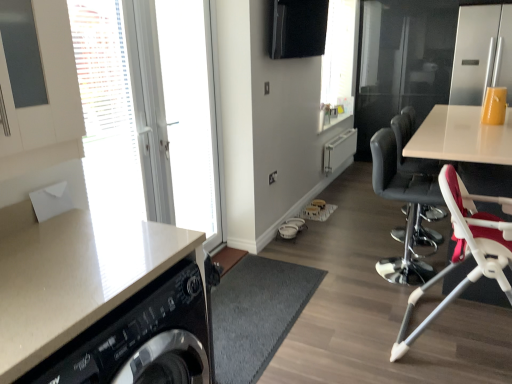
Question: In terms of height, does white glossy door at left, which ranks as the second window in back-to-front order, look taller or shorter compared to white glass door at left, which is counted as the second window screen, starting from the right?

Choices:
 (A) tall
 (B) short

Answer: (B)

Question: In terms of size, does white glossy door at left, the first window when ordered from front to back, appear bigger or smaller than white glass door at left, the 1th window screen positioned from the left?

Choices:
 (A) big
 (B) small

Answer: (A)

Question: Which of these objects is positioned closest to the black leather chair at right, which appears as the 2th chair when viewed from the front?

Choices:
 (A) white glossy countertop at lower left
 (B) black leather bar stool at right
 (C) black glossy washing machine at lower left
 (D) white plastic high chair at right
 (E) white glossy door at left, which is counted as the first window, starting from the back

Answer: (B)

Question: Which of these objects is positioned farthest from the red fabric high chair at right, positioned as the second chair in back-to-front order?

Choices:
 (A) white glossy countertop at lower left
 (B) transparent glass window screen at upper center, which appears as the first window screen when viewed from the back
 (C) white glass door at left, which is counted as the second window screen, starting from the right
 (D) black leather bar stool at right
 (E) white glossy door at left, which is counted as the first window, starting from the back

Answer: (B)